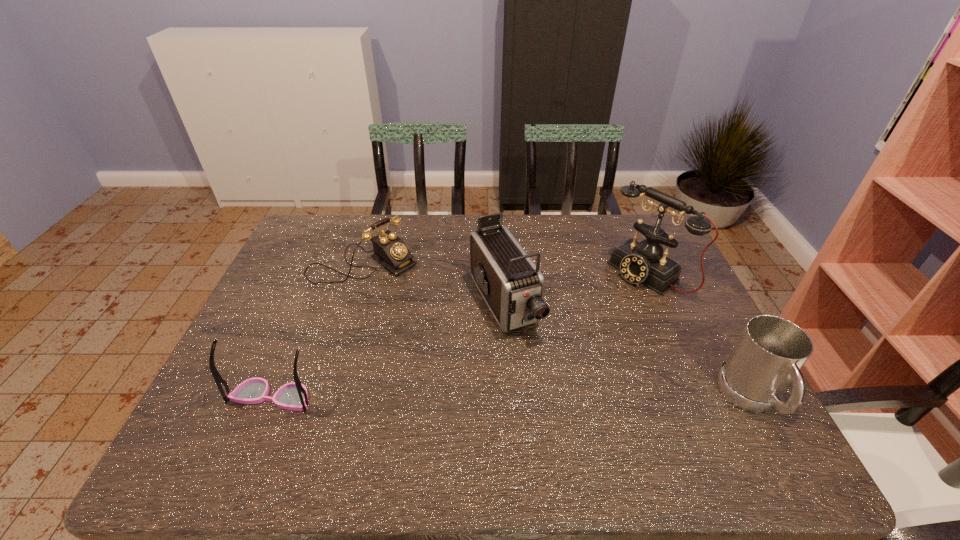
The width and height of the screenshot is (960, 540). I want to click on blank space located at the lens of the third object from right to left, so click(x=557, y=401).

This screenshot has height=540, width=960. What are the coordinates of `free space located 0.260m at the lens of the third object from right to left` in the screenshot? It's located at (572, 426).

The image size is (960, 540). I want to click on vacant space located on the dial of the right telephone, so click(566, 335).

Identify the location of free space located 0.240m on the dial of the right telephone. This screenshot has width=960, height=540. (571, 332).

In order to click on free space located on the dial of the right telephone in this screenshot , I will do `click(590, 318)`.

Image resolution: width=960 pixels, height=540 pixels. Find the location of `spectacles situated at the near edge`. spectacles situated at the near edge is located at coordinates tap(293, 396).

Locate an element on the screen. Image resolution: width=960 pixels, height=540 pixels. mug at the near edge is located at coordinates (770, 352).

Identify the location of spectacles that is positioned at the left edge. Image resolution: width=960 pixels, height=540 pixels. (293, 396).

Where is `telephone that is at the left edge`? This screenshot has width=960, height=540. telephone that is at the left edge is located at coordinates (390, 251).

Find the location of `mug present at the right edge`. mug present at the right edge is located at coordinates (770, 352).